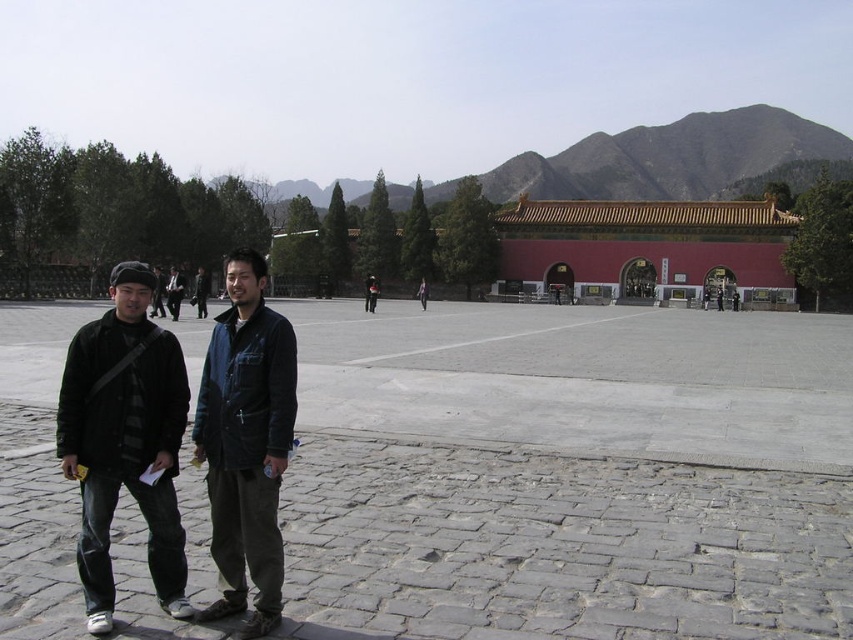
Question: Is the position of red matte building at center more distant than that of matte black jacket at center?

Choices:
 (A) yes
 (B) no

Answer: (A)

Question: Does black matte jacket at left have a lesser width compared to matte black jacket at center?

Choices:
 (A) no
 (B) yes

Answer: (B)

Question: Which of the following is the farthest from the observer?

Choices:
 (A) matte black jacket at center
 (B) denim jacket at center
 (C) red matte building at center
 (D) dark blue denim jacket at center

Answer: (C)

Question: Which object appears farthest from the camera in this image?

Choices:
 (A) black matte jacket at left
 (B) denim jacket at center
 (C) dark blue jacket at center

Answer: (C)

Question: Observing the image, what is the correct spatial positioning of black matte jacket at left in reference to matte black jacket at center?

Choices:
 (A) left
 (B) right

Answer: (B)

Question: Which of the following is the closest to the observer?

Choices:
 (A) dark blue jacket at center
 (B) matte black jacket at center
 (C) black matte jacket at left
 (D) red matte building at center

Answer: (C)